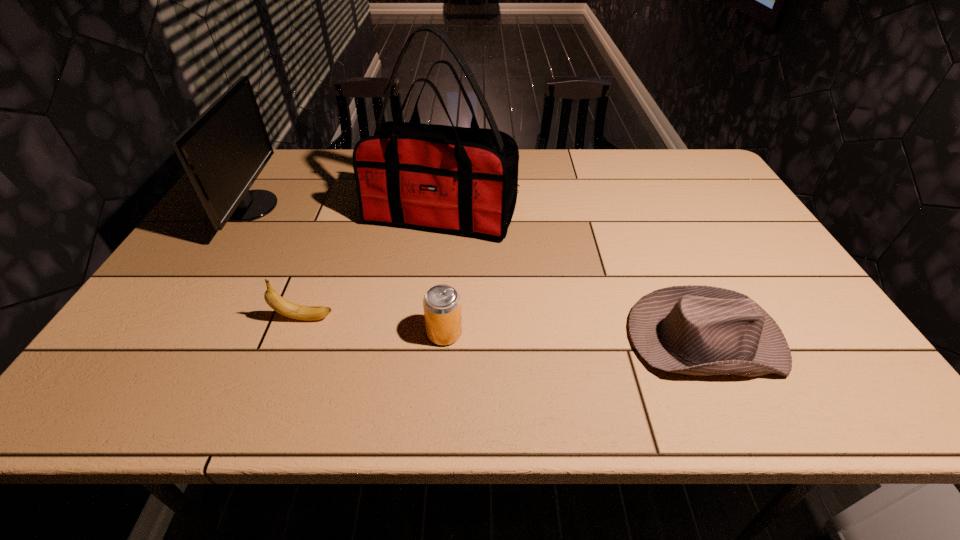
Where is `vacant space that satisfies the following two spatial constraints: 1. at the start of the peel on the banana; 2. on the back side of the pop (soda)`? vacant space that satisfies the following two spatial constraints: 1. at the start of the peel on the banana; 2. on the back side of the pop (soda) is located at coordinates (300, 333).

The width and height of the screenshot is (960, 540). Find the location of `free location that satisfies the following two spatial constraints: 1. on the screen side of the second tallest object; 2. on the back side of the pop (soda)`. free location that satisfies the following two spatial constraints: 1. on the screen side of the second tallest object; 2. on the back side of the pop (soda) is located at coordinates [168, 333].